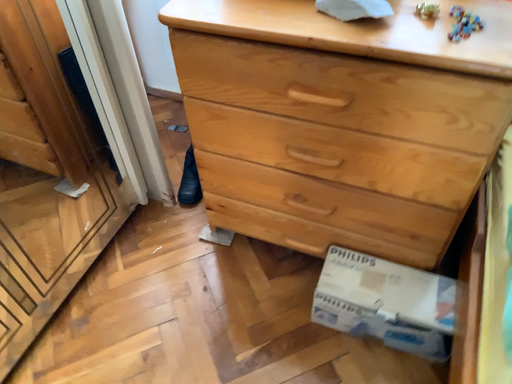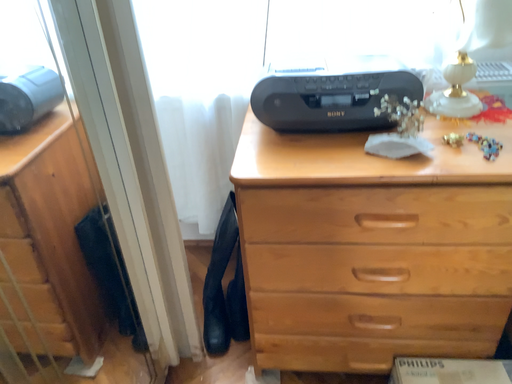
Question: Which way did the camera rotate in the video?

Choices:
 (A) rotated left
 (B) rotated right

Answer: (B)